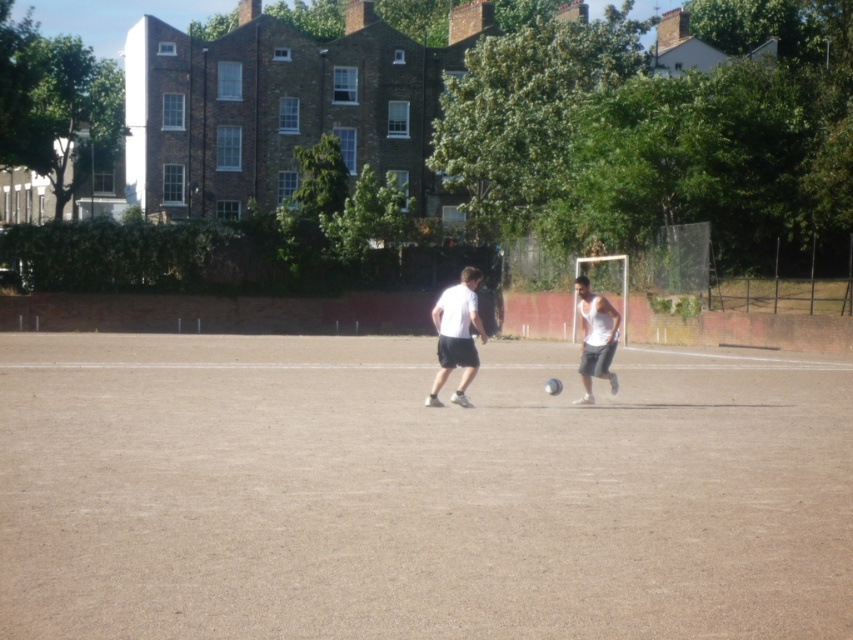
Based on the photo, can you confirm if white matte shorts at center is smaller than white matte tank top at center?

Correct, white matte shorts at center occupies less space than white matte tank top at center.

Is point (462, 396) farther from camera compared to point (616, 392)?

No, it is not.

I want to click on white matte shorts at center, so click(x=456, y=336).

Consider the image. Which is below, brown textured ground at center or white matte shorts at center?

Positioned lower is brown textured ground at center.

Between point (421, 524) and point (456, 401), which one is positioned in front?

Point (421, 524) is in front.

Where is `brown textured ground at center`? This screenshot has width=853, height=640. brown textured ground at center is located at coordinates (416, 492).

Looking at this image, who is lower down, brown textured ground at center or white matte tank top at center?

brown textured ground at center is below.

Does point (85, 589) lie in front of point (612, 332)?

Yes, it is in front of point (612, 332).

Is point (390, 624) positioned behind point (579, 298)?

That is False.

Where is `brown textured ground at center`? This screenshot has width=853, height=640. brown textured ground at center is located at coordinates (416, 492).